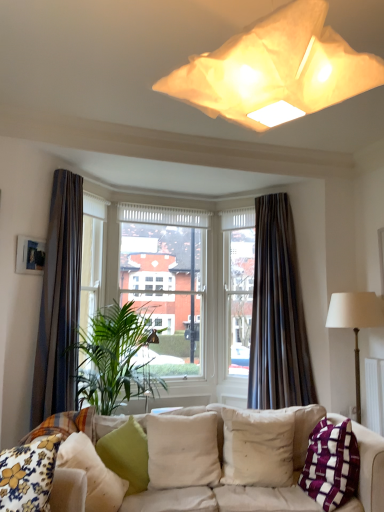
Question: From the image's perspective, does green fabric pillow at lower left, arranged as the 2th pillow when viewed from the left, appear higher than purple woven pillow at lower right, the 6th pillow from the left?

Choices:
 (A) no
 (B) yes

Answer: (B)

Question: From the image's perspective, would you say green fabric pillow at lower left, arranged as the 2th pillow when viewed from the left, is shown under purple woven pillow at lower right, which appears as the first pillow when viewed from the right?

Choices:
 (A) no
 (B) yes

Answer: (A)

Question: Is green fabric pillow at lower left, which is counted as the 5th pillow, starting from the right, touching purple woven pillow at lower right, which appears as the first pillow when viewed from the right?

Choices:
 (A) no
 (B) yes

Answer: (A)

Question: Does green fabric pillow at lower left, arranged as the 2th pillow when viewed from the left, have a greater height compared to purple woven pillow at lower right, which appears as the first pillow when viewed from the right?

Choices:
 (A) no
 (B) yes

Answer: (A)

Question: Considering the relative positions of green fabric pillow at lower left, arranged as the 2th pillow when viewed from the left, and purple woven pillow at lower right, the 6th pillow from the left, in the image provided, is green fabric pillow at lower left, arranged as the 2th pillow when viewed from the left, to the right of purple woven pillow at lower right, the 6th pillow from the left, from the viewer's perspective?

Choices:
 (A) yes
 (B) no

Answer: (B)

Question: Is green fabric pillow at lower left, arranged as the 2th pillow when viewed from the left, not close to purple woven pillow at lower right, the 6th pillow from the left?

Choices:
 (A) no
 (B) yes

Answer: (B)

Question: Is beige fabric pillow at center, which is the 2th pillow from right to left, facing towards green fabric cushion at lower left, which is counted as the 3th pillow, starting from the left?

Choices:
 (A) no
 (B) yes

Answer: (A)

Question: From the image's perspective, is beige fabric pillow at center, positioned as the fifth pillow in left-to-right order, on green fabric cushion at lower left, which is counted as the 3th pillow, starting from the left?

Choices:
 (A) no
 (B) yes

Answer: (B)

Question: From the image's perspective, does beige fabric pillow at center, which is the 2th pillow from right to left, appear lower than green fabric cushion at lower left, which is counted as the 3th pillow, starting from the left?

Choices:
 (A) no
 (B) yes

Answer: (A)

Question: Considering the relative sizes of beige fabric pillow at center, which is the 2th pillow from right to left, and green fabric cushion at lower left, the 4th pillow in the right-to-left sequence, in the image provided, is beige fabric pillow at center, which is the 2th pillow from right to left, smaller than green fabric cushion at lower left, the 4th pillow in the right-to-left sequence,?

Choices:
 (A) yes
 (B) no

Answer: (B)

Question: From a real-world perspective, is beige fabric pillow at center, positioned as the fifth pillow in left-to-right order, beneath green fabric cushion at lower left, the 4th pillow in the right-to-left sequence?

Choices:
 (A) no
 (B) yes

Answer: (A)

Question: Is beige fabric pillow at center, which is the 2th pillow from right to left, bigger than green fabric cushion at lower left, which is counted as the 3th pillow, starting from the left?

Choices:
 (A) yes
 (B) no

Answer: (A)

Question: Is purple woven pillow at lower right, the 6th pillow from the left, shorter than beige fabric pillow at center, which is counted as the 4th pillow, starting from the left?

Choices:
 (A) no
 (B) yes

Answer: (A)